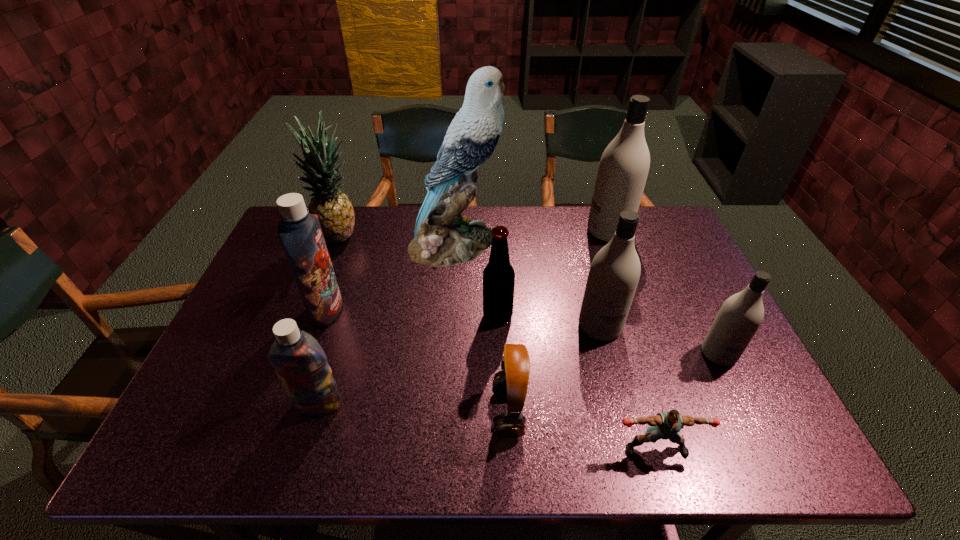
In order to click on vacant area situated 0.380m on the front label of the farther blue shampoo in this screenshot , I will do `click(479, 309)`.

Find the location of a particular element. vacant area situated 0.090m on the front-facing side of the second biggest white shampoo is located at coordinates (612, 373).

The height and width of the screenshot is (540, 960). Identify the location of blank area located on the right of the beer bottle. (586, 316).

Where is `vacant space located on the front-facing side of the rightmost object`? Image resolution: width=960 pixels, height=540 pixels. vacant space located on the front-facing side of the rightmost object is located at coordinates (761, 442).

At what (x,y) coordinates should I click in order to perform the action: click on blank space located on the ear cups of the ninth tallest object. Please return your answer as a coordinate pair (x, y). The image size is (960, 540). Looking at the image, I should click on (470, 413).

Find the location of a particular element. The width and height of the screenshot is (960, 540). free point located 0.250m on the ear cups of the ninth tallest object is located at coordinates (x=381, y=413).

You are a GUI agent. You are given a task and a screenshot of the screen. Output one action in this format:
    pyautogui.click(x=<x>, y=<y>)
    Task: Click on the vacant region located on the ear cups of the ninth tallest object
    The image size is (960, 540).
    Given the screenshot: What is the action you would take?
    pyautogui.click(x=346, y=413)

Locate an element on the screen. parakeet present at the far edge is located at coordinates (443, 237).

You are a GUI agent. You are given a task and a screenshot of the screen. Output one action in this format:
    pyautogui.click(x=<x>, y=<y>)
    Task: Click on the shampoo situated at the far edge
    
    Given the screenshot: What is the action you would take?
    pyautogui.click(x=624, y=165)

Locate an element on the screen. pineapple that is at the far edge is located at coordinates (335, 212).